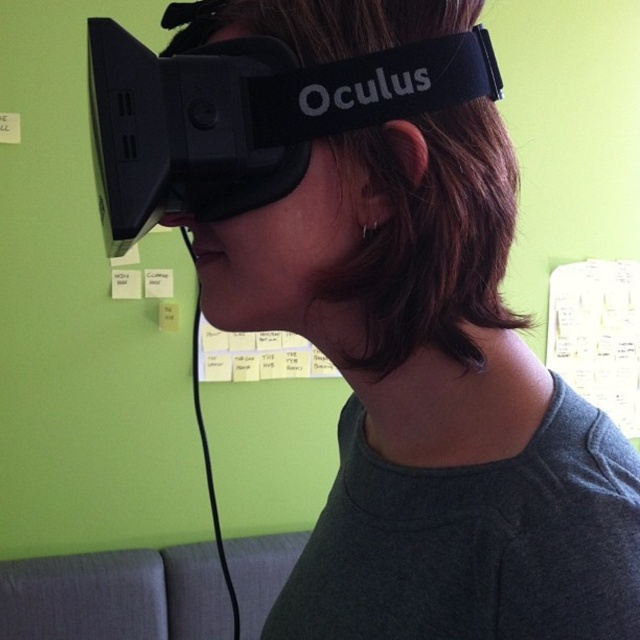
Does point (390, 56) come farther from viewer compared to point (625, 268)?

No.

From the picture: Which is above, black matte vr goggles at center or white paper notes at upper center?

Positioned higher is black matte vr goggles at center.

Locate an element on the screen. Image resolution: width=640 pixels, height=640 pixels. black matte vr goggles at center is located at coordinates (248, 116).